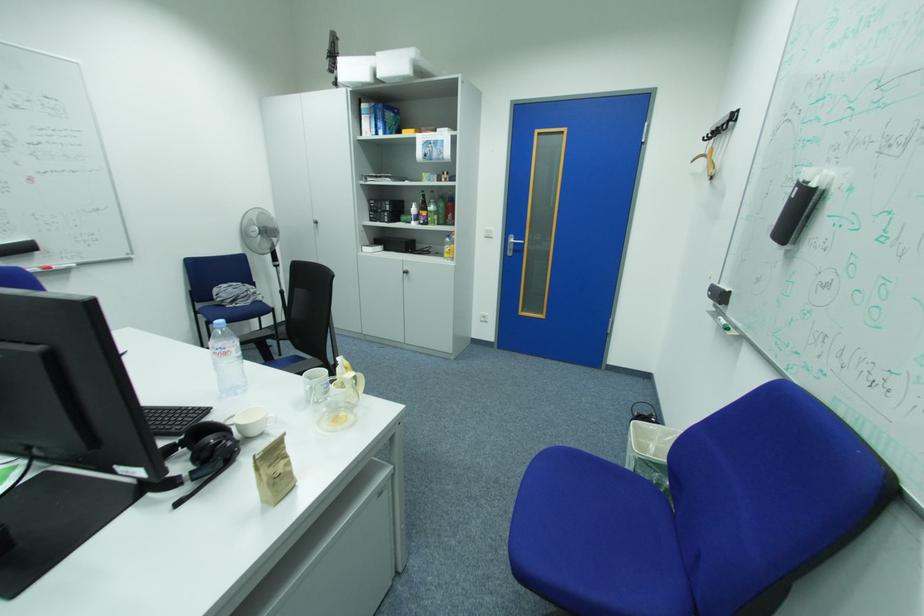
Where would you putting-in the white trash can? Please return your answer as a coordinate pair (x, y).

(650, 451)